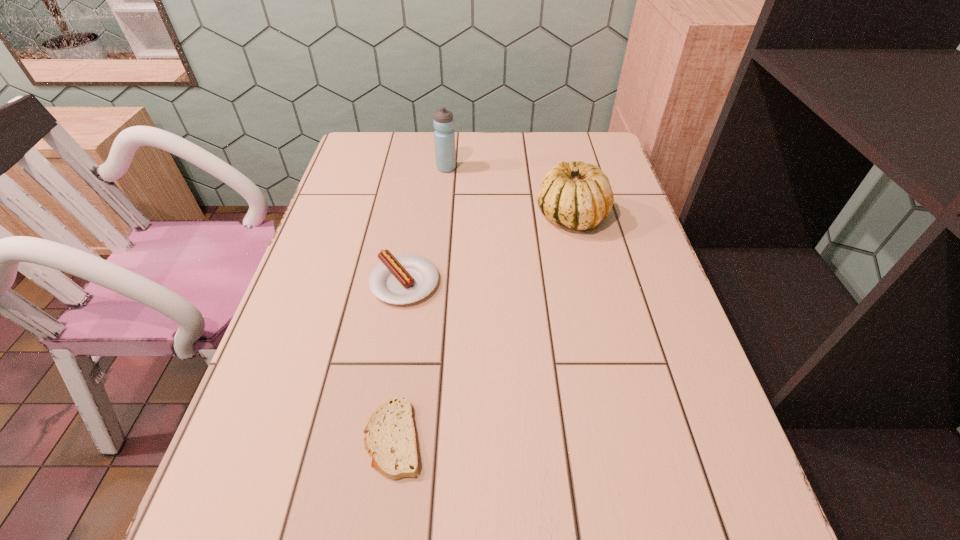
At what (x,y) coordinates should I click in order to perform the action: click on blank space located 0.300m on the front of the third tallest object. Please return your answer as a coordinate pair (x, y). The image size is (960, 540). Looking at the image, I should click on (378, 442).

What are the coordinates of `free space located on the left of the nearest object` in the screenshot? It's located at (248, 438).

This screenshot has height=540, width=960. Identify the location of object positioned at the far edge. (444, 136).

You are a GUI agent. You are given a task and a screenshot of the screen. Output one action in this format:
    pyautogui.click(x=<x>, y=<y>)
    Task: Click on the object that is at the right edge
    This screenshot has height=540, width=960.
    Given the screenshot: What is the action you would take?
    pyautogui.click(x=578, y=195)

In the image, there is a desktop. Where is `vacant space at the far edge`? Image resolution: width=960 pixels, height=540 pixels. vacant space at the far edge is located at coordinates (496, 133).

Locate an element on the screen. The height and width of the screenshot is (540, 960). free location at the near edge of the desktop is located at coordinates (406, 536).

Locate an element on the screen. Image resolution: width=960 pixels, height=540 pixels. vacant region at the left edge of the desktop is located at coordinates (323, 242).

The width and height of the screenshot is (960, 540). I want to click on blank space at the right edge of the desktop, so click(599, 315).

In the image, there is a desktop. At what (x,y) coordinates should I click in order to perform the action: click on vacant region at the far right corner. Please return your answer as a coordinate pair (x, y). The width and height of the screenshot is (960, 540). Looking at the image, I should click on (568, 139).

This screenshot has height=540, width=960. I want to click on free space between the third shortest object and the second shortest object, so click(x=488, y=249).